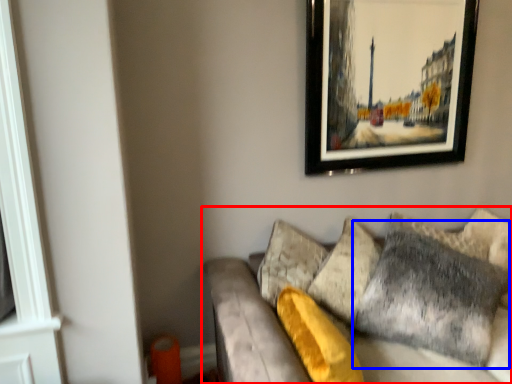
Question: Which of the following is the closest to the observer, studio couch (highlighted by a red box) or pillow (highlighted by a blue box)?

Choices:
 (A) studio couch
 (B) pillow

Answer: (A)